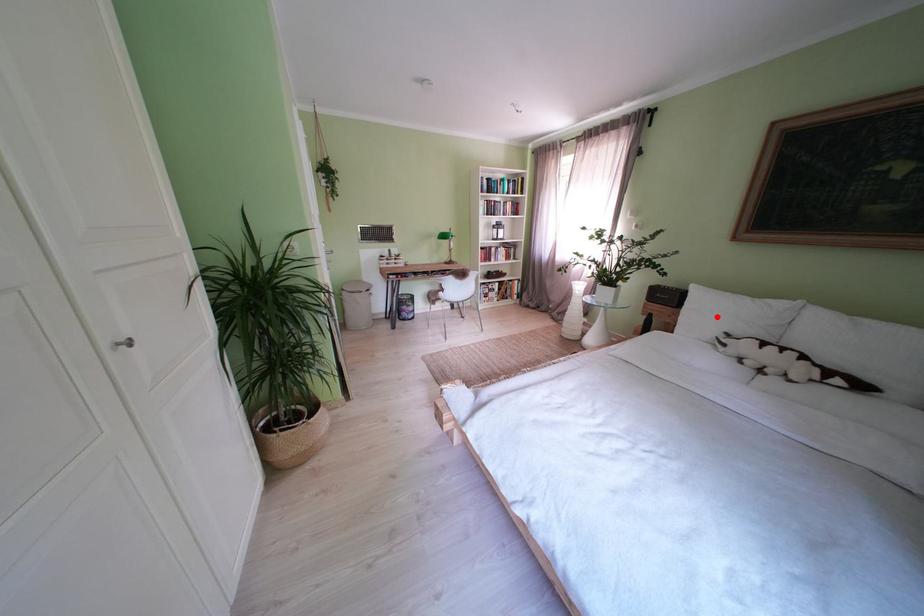
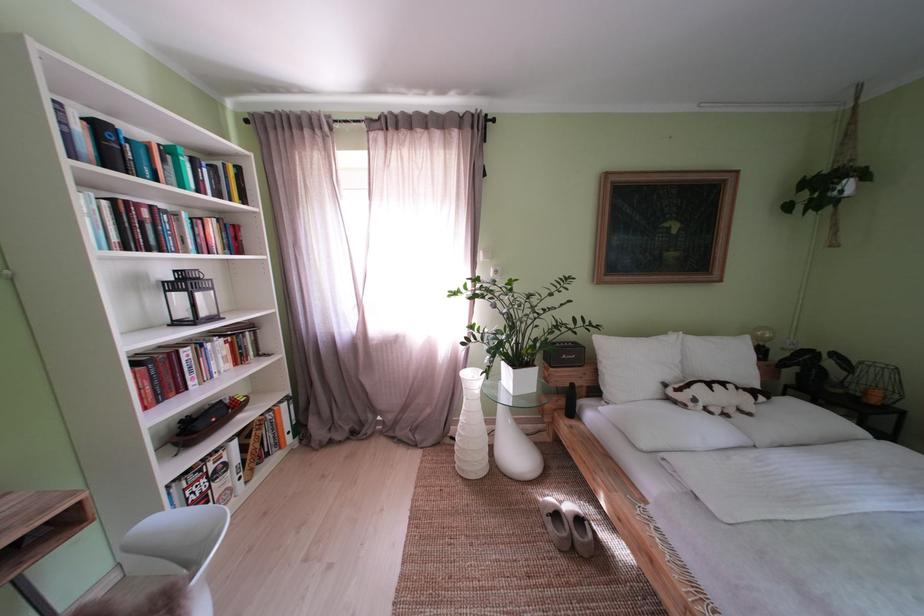
Question: I am providing you with two images of the same scene from different viewpoints. Given a red point in image1, look at the same physical point in image2. Is it:

Choices:
 (A) Closer to the viewpoint
 (B) Farther from the viewpoint

Answer: (B)